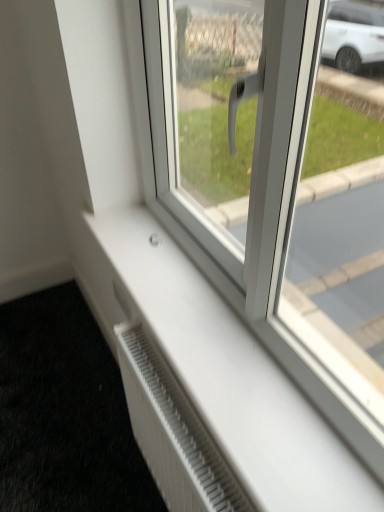
What are the coordinates of `white plastic radiator at lower center` in the screenshot? It's located at (173, 432).

Does white plastic radiator at lower center have a larger size compared to white textured radiator at lower left?

Actually, white plastic radiator at lower center might be smaller than white textured radiator at lower left.

From a real-world perspective, which is physically below, white plastic radiator at lower center or white textured radiator at lower left?

white textured radiator at lower left.

Is white plastic radiator at lower center next to white textured radiator at lower left and touching it?

No, white plastic radiator at lower center is not making contact with white textured radiator at lower left.

Can you tell me how much white plastic radiator at lower center and white textured radiator at lower left differ in facing direction?

There is a 86.5-degree angle between the facing directions of white plastic radiator at lower center and white textured radiator at lower left.

Is white plastic window at center located outside white plastic radiator at lower center?

Absolutely, white plastic window at center is external to white plastic radiator at lower center.

Can you confirm if white plastic window at center is positioned to the right of white plastic radiator at lower center?

Correct, you'll find white plastic window at center to the right of white plastic radiator at lower center.

Is white plastic window at center with white plastic radiator at lower center?

No, white plastic window at center is not with white plastic radiator at lower center.

Does white plastic window at center have a lesser height compared to white plastic radiator at lower center?

Indeed, white plastic window at center has a lesser height compared to white plastic radiator at lower center.

Considering the sizes of objects white textured radiator at lower left and white plastic window at center in the image provided, who is wider, white textured radiator at lower left or white plastic window at center?

white textured radiator at lower left.

Which is further, (123, 407) or (199, 11)?

The point (123, 407) is behind.

In the scene shown: Which object is further away from the camera, white textured radiator at lower left or white plastic window at center?

white textured radiator at lower left is further away from the camera.

From their relative heights in the image, would you say white textured radiator at lower left is taller or shorter than white plastic window at center?

white textured radiator at lower left is taller than white plastic window at center.

Considering the positions of objects white textured radiator at lower left and white plastic radiator at lower center in the image provided, who is more to the left, white textured radiator at lower left or white plastic radiator at lower center?

From the viewer's perspective, white textured radiator at lower left appears more on the left side.

The height and width of the screenshot is (512, 384). I want to click on radiator above the white textured radiator at lower left (from a real-world perspective), so click(173, 432).

Is point (49, 485) more distant than point (147, 446)?

Yes, it is behind point (147, 446).

From the image's perspective, is white plastic radiator at lower center above or below white plastic window at center?

white plastic radiator at lower center is below white plastic window at center.

Locate an element on the screen. This screenshot has width=384, height=512. radiator on the left of the white plastic window at center is located at coordinates (173, 432).

Can you confirm if white plastic radiator at lower center is bigger than white plastic window at center?

Correct, white plastic radiator at lower center is larger in size than white plastic window at center.

Is white plastic window at center inside white plastic radiator at lower center?

No, white plastic radiator at lower center does not contain white plastic window at center.

Does white plastic window at center lie behind white textured radiator at lower left?

No, it is not.

Who is bigger, white plastic window at center or white textured radiator at lower left?

With larger size is white textured radiator at lower left.

Where is `window in front of the white textured radiator at lower left`? This screenshot has height=512, width=384. window in front of the white textured radiator at lower left is located at coordinates (272, 186).

Between white plastic window at center and white textured radiator at lower left, which one has larger width?

white textured radiator at lower left.

Identify the location of pavement behind the white plastic radiator at lower center. This screenshot has width=384, height=512. (65, 413).

I want to click on window located in front of the white plastic radiator at lower center, so click(x=272, y=186).

From the image, which object appears to be nearer to white textured radiator at lower left, white plastic radiator at lower center or white plastic window at center?

white plastic radiator at lower center.

Estimate the real-world distances between objects in this image. Which object is closer to white plastic radiator at lower center, white textured radiator at lower left or white plastic window at center?

white plastic window at center is closer to white plastic radiator at lower center.

Which object lies nearer to the anchor point white plastic window at center, white textured radiator at lower left or white plastic radiator at lower center?

Based on the image, white plastic radiator at lower center appears to be nearer to white plastic window at center.

Estimate the real-world distances between objects in this image. Which object is closer to white plastic radiator at lower center, white plastic window at center or white textured radiator at lower left?

Based on the image, white plastic window at center appears to be nearer to white plastic radiator at lower center.

From the image, which object appears to be farther from white textured radiator at lower left, white plastic window at center or white plastic radiator at lower center?

Among the two, white plastic window at center is located further to white textured radiator at lower left.

Estimate the real-world distances between objects in this image. Which object is further from white plastic window at center, white plastic radiator at lower center or white textured radiator at lower left?

white textured radiator at lower left is positioned further to the anchor white plastic window at center.

Locate an element on the screen. The image size is (384, 512). radiator between white plastic window at center and white textured radiator at lower left in the front-back direction is located at coordinates (173, 432).